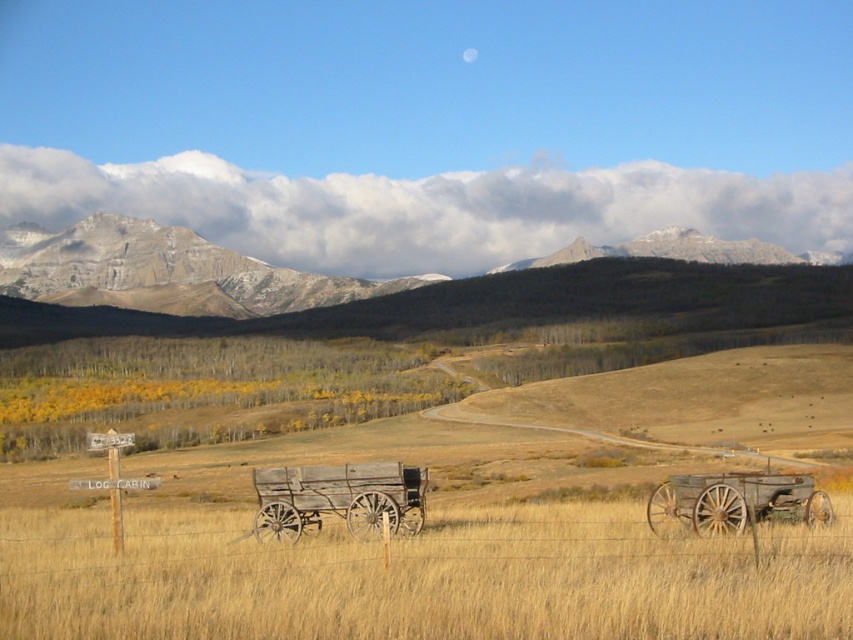
You are standing at the origin point of the scene. Where is the weathered wood wagon at center located in terms of coordinates?

The weathered wood wagon at center is located at coordinates point (338,499).

You are a traveler trying to reach the log cabin indicated by the signpost. You see the rocky gray mountains at upper center and the rustic wood wagon at right. Which of these two objects is bigger in size?

The rocky gray mountains at upper center is larger in size than rustic wood wagon at right.